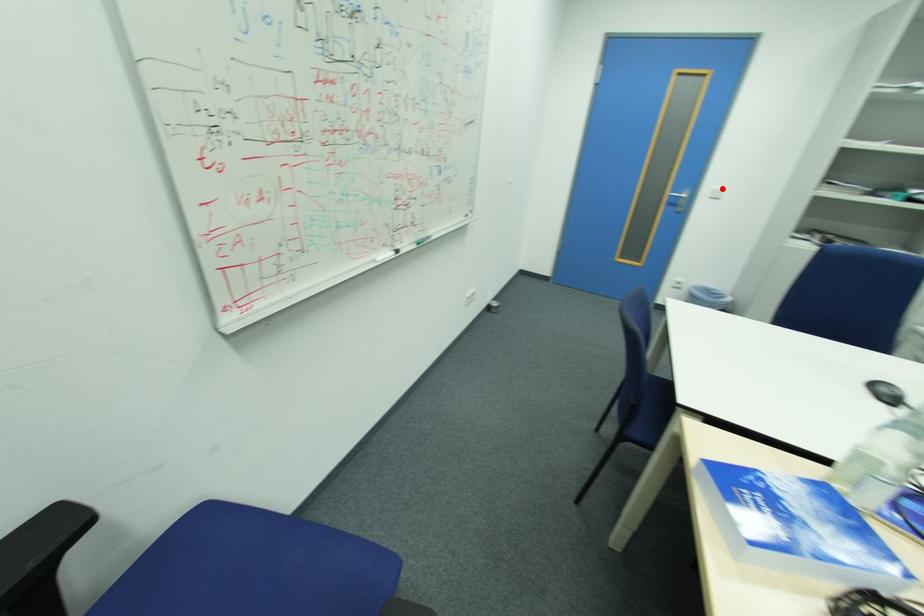
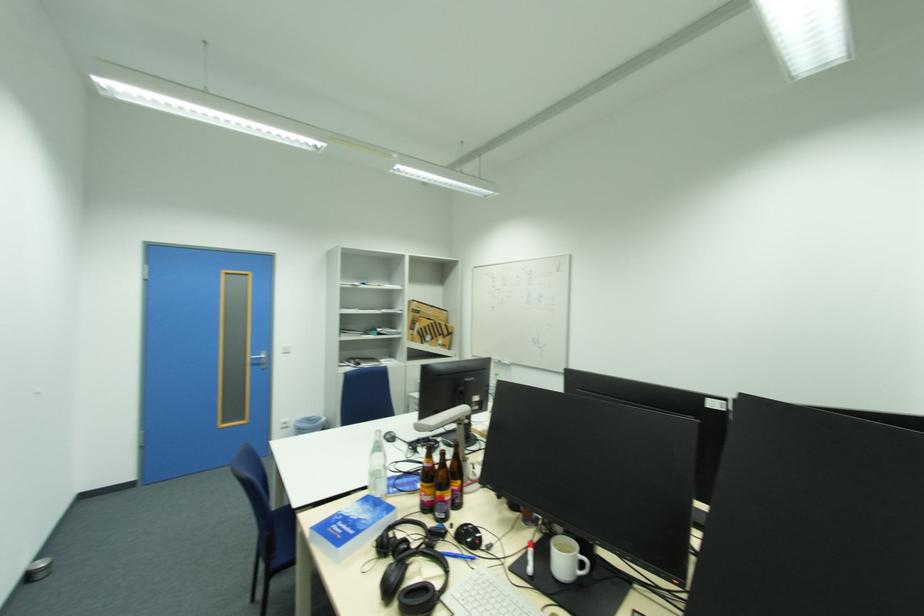
Question: I am providing you with two images of the same scene from different viewpoints. Given a red point in image1, look at the same physical point in image2. Is it:

Choices:
 (A) Closer to the viewpoint
 (B) Farther from the viewpoint

Answer: (B)